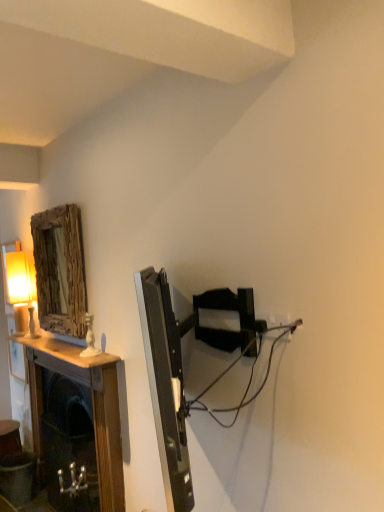
Describe the element at coordinates (92, 406) in the screenshot. The width and height of the screenshot is (384, 512). I see `wooden mantel at left` at that location.

This screenshot has height=512, width=384. I want to click on wooden textured mirror at upper left, so click(x=57, y=270).

At what (x,y) coordinates should I click in order to perform the action: click on table lamp behind the wooden textured mirror at upper left. Please return your answer as a coordinate pair (x, y). The image size is (384, 512). Looking at the image, I should click on (20, 290).

How distant is matte cream table lamp at left from wooden textured mirror at upper left?

matte cream table lamp at left is 12.03 inches away from wooden textured mirror at upper left.

From a real-world perspective, is matte cream table lamp at left physically located above or below wooden textured mirror at upper left?

matte cream table lamp at left is situated lower than wooden textured mirror at upper left in the real world.

Is matte cream table lamp at left located outside wooden textured mirror at upper left?

Yes, matte cream table lamp at left is located beyond the bounds of wooden textured mirror at upper left.

Is wooden textured mirror at upper left wider or thinner than black plastic cable at center right?

Considering their sizes, wooden textured mirror at upper left looks slimmer than black plastic cable at center right.

Locate an element on the screen. mirror above the black plastic cable at center right (from a real-world perspective) is located at coordinates (57, 270).

Considering the relative positions of wooden textured mirror at upper left and black plastic cable at center right in the image provided, is wooden textured mirror at upper left behind black plastic cable at center right?

That is True.

Is wooden textured mirror at upper left not inside black plastic cable at center right?

Yes.

From the image's perspective, does black plastic cable at center right appear lower than matte cream table lamp at left?

Correct, black plastic cable at center right appears lower than matte cream table lamp at left in the image.

Find the location of `table lamp located above the black plastic cable at center right (from a real-world perspective)`. table lamp located above the black plastic cable at center right (from a real-world perspective) is located at coordinates (20, 290).

Based on the photo, could you tell me if black plastic cable at center right is facing matte cream table lamp at left?

No.

Does black plastic cable at center right have a greater height compared to matte cream table lamp at left?

In fact, black plastic cable at center right may be shorter than matte cream table lamp at left.

Is the depth of wooden mantel at left greater than that of black plastic cable at center right?

Yes, it is.

Is wooden mantel at left at the right side of black plastic cable at center right?

Incorrect, wooden mantel at left is not on the right side of black plastic cable at center right.

Does point (97, 380) come in front of point (225, 371)?

No, it is not.

Is wooden mantel at left oriented towards black plastic cable at center right?

No.

Looking at this image, considering the relative sizes of wooden mantel at left and wooden textured mirror at upper left in the image provided, is wooden mantel at left wider than wooden textured mirror at upper left?

Correct, the width of wooden mantel at left exceeds that of wooden textured mirror at upper left.

Is wooden mantel at left next to wooden textured mirror at upper left?

wooden mantel at left and wooden textured mirror at upper left are clearly separated.

Measure the distance from wooden mantel at left to wooden textured mirror at upper left.

The distance of wooden mantel at left from wooden textured mirror at upper left is 17.41 inches.

Considering the positions of objects wooden mantel at left and wooden textured mirror at upper left in the image provided, who is behind, wooden mantel at left or wooden textured mirror at upper left?

Positioned behind is wooden textured mirror at upper left.

Can you confirm if wooden mantel at left is shorter than matte cream table lamp at left?

No, wooden mantel at left is not shorter than matte cream table lamp at left.

I want to click on table lamp that is above the wooden mantel at left (from the image's perspective), so click(20, 290).

How many degrees apart are the facing directions of wooden mantel at left and matte cream table lamp at left?

They differ by 0.0137 degrees in their facing directions.

Is wooden textured mirror at upper left oriented away from wooden mantel at left?

No, wooden textured mirror at upper left's orientation is not away from wooden mantel at left.

From the image's perspective, would you say wooden textured mirror at upper left is shown under wooden mantel at left?

No.

Is wooden textured mirror at upper left inside or outside of wooden mantel at left?

wooden textured mirror at upper left is not inside wooden mantel at left, it's outside.

The width and height of the screenshot is (384, 512). I want to click on mirror above the matte cream table lamp at left (from the image's perspective), so click(x=57, y=270).

This screenshot has width=384, height=512. I want to click on mirror behind the black plastic cable at center right, so click(57, 270).

When comparing their distances from wooden mantel at left, does black plastic cable at center right or wooden textured mirror at upper left seem closer?

Among the two, wooden textured mirror at upper left is located nearer to wooden mantel at left.

Estimate the real-world distances between objects in this image. Which object is further from matte cream table lamp at left, wooden mantel at left or black plastic cable at center right?

black plastic cable at center right lies further to matte cream table lamp at left than the other object.

Estimate the real-world distances between objects in this image. Which object is further from black plastic cable at center right, wooden mantel at left or wooden textured mirror at upper left?

wooden textured mirror at upper left is further to black plastic cable at center right.

Considering their positions, is wooden mantel at left positioned closer to black plastic cable at center right than matte cream table lamp at left?

wooden mantel at left lies closer to black plastic cable at center right than the other object.

Based on their spatial positions, is black plastic cable at center right or wooden mantel at left closer to matte cream table lamp at left?

Based on the image, wooden mantel at left appears to be nearer to matte cream table lamp at left.

Estimate the real-world distances between objects in this image. Which object is closer to matte cream table lamp at left, wooden textured mirror at upper left or black plastic cable at center right?

wooden textured mirror at upper left lies closer to matte cream table lamp at left than the other object.

When comparing their distances from wooden mantel at left, does matte cream table lamp at left or wooden textured mirror at upper left seem closer?

wooden textured mirror at upper left.

Estimate the real-world distances between objects in this image. Which object is closer to wooden textured mirror at upper left, wooden mantel at left or matte cream table lamp at left?

The object closer to wooden textured mirror at upper left is matte cream table lamp at left.

The image size is (384, 512). I want to click on table lamp between wooden textured mirror at upper left and wooden mantel at left from top to bottom, so click(20, 290).

You are a GUI agent. You are given a task and a screenshot of the screen. Output one action in this format:
    pyautogui.click(x=<x>, y=<y>)
    Task: Click on the table positioned between black plastic cable at center right and matte cream table lamp at left from near to far
    
    Given the screenshot: What is the action you would take?
    pyautogui.click(x=92, y=406)

The width and height of the screenshot is (384, 512). What are the coordinates of `mirror located between black plastic cable at center right and matte cream table lamp at left in the depth direction` in the screenshot? It's located at (57, 270).

Locate an element on the screen. This screenshot has width=384, height=512. table located between wooden textured mirror at upper left and black plastic cable at center right in the left-right direction is located at coordinates (92, 406).